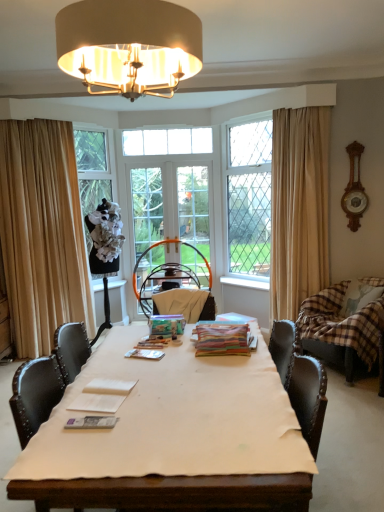
Identify the location of vacant space in front of multicolored paper stack at center, marked as the 3th magazine in a bottom-to-top arrangement. Image resolution: width=384 pixels, height=512 pixels. (245, 369).